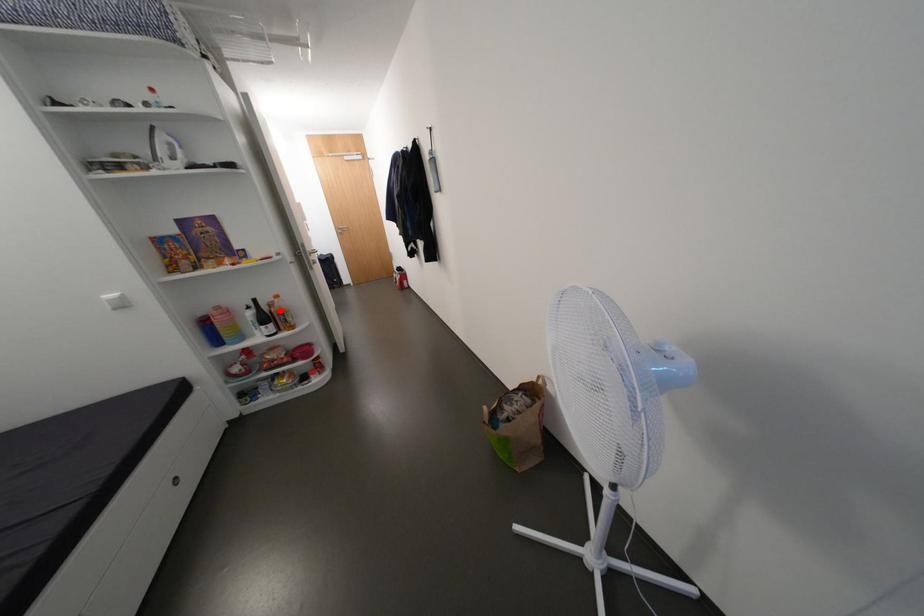
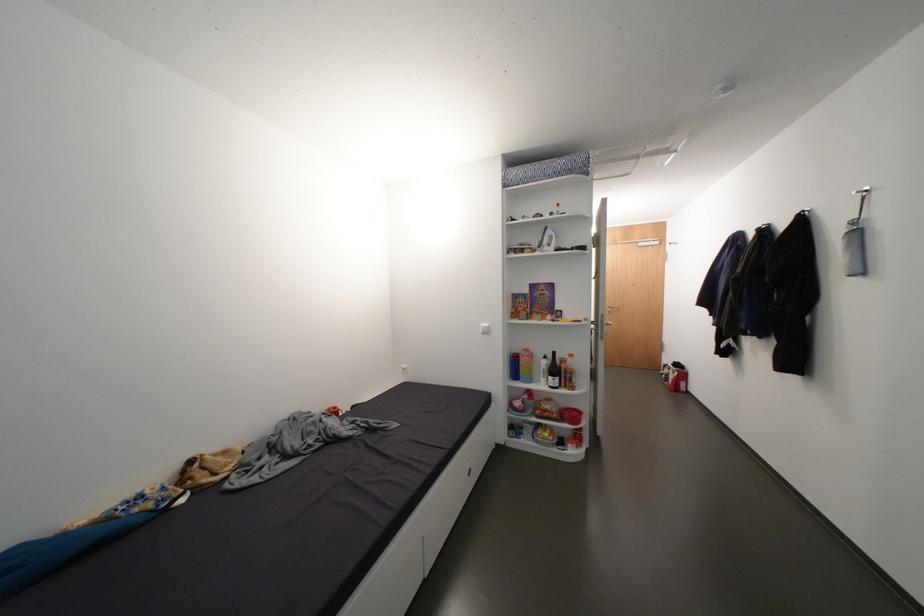
In the second image, find the point that corresponds to the highlighted location in the first image.

(570, 367)